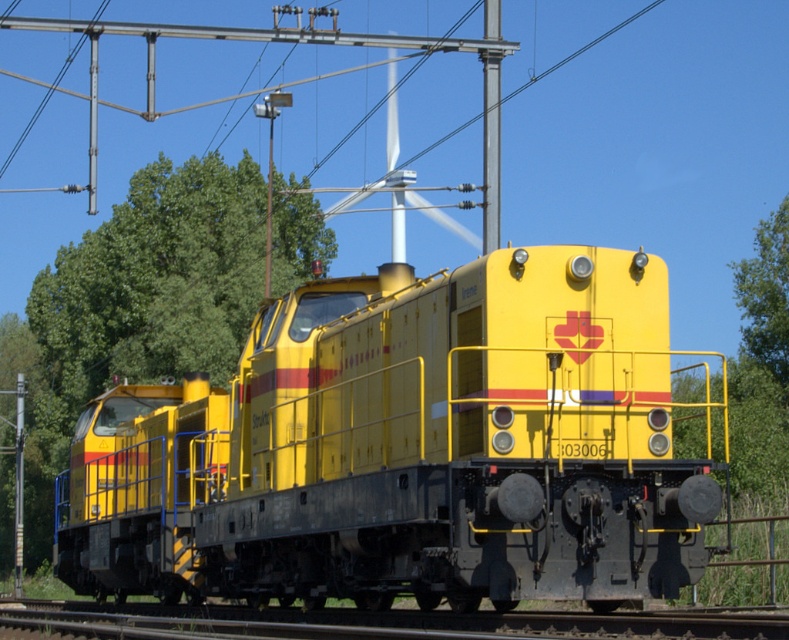
Question: Considering the relative positions of yellow matte train at center and metallic pole at upper center in the image provided, where is yellow matte train at center located with respect to metallic pole at upper center?

Choices:
 (A) below
 (B) above

Answer: (A)

Question: Estimate the real-world distances between objects in this image. Which object is closer to the green leafy tree at left?

Choices:
 (A) yellow matte train at center
 (B) metallic pole at upper center

Answer: (B)

Question: Can you confirm if green leafy tree at left is bigger than metallic pole at upper center?

Choices:
 (A) yes
 (B) no

Answer: (A)

Question: Which point is farther from the camera taking this photo?

Choices:
 (A) (494, 12)
 (B) (85, 250)

Answer: (B)

Question: Which point is farther from the camera taking this photo?

Choices:
 (A) pos(257,586)
 (B) pos(488,156)
 (C) pos(257,260)

Answer: (C)

Question: From the image, what is the correct spatial relationship of yellow matte train at center in relation to metallic pole at upper center?

Choices:
 (A) below
 (B) above

Answer: (A)